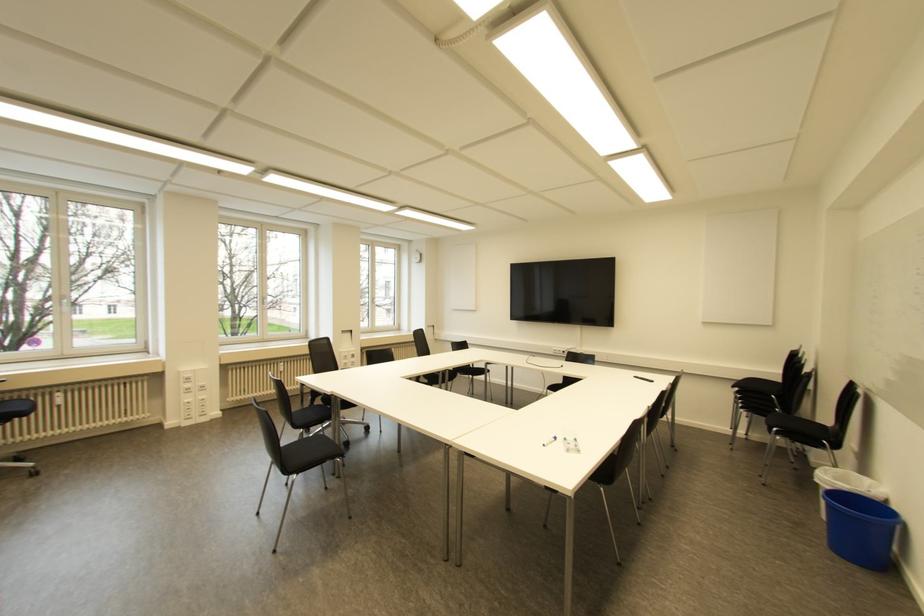
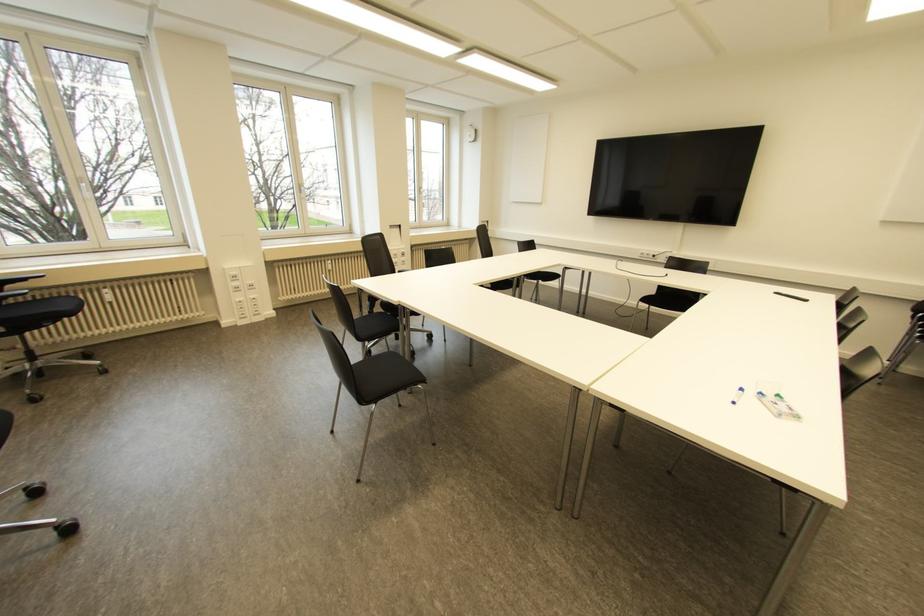
Question: The images are taken continuously from a first-person perspective. In which direction is your viewpoint rotating?

Choices:
 (A) Left
 (B) Right
 (C) Up
 (D) Down

Answer: (D)